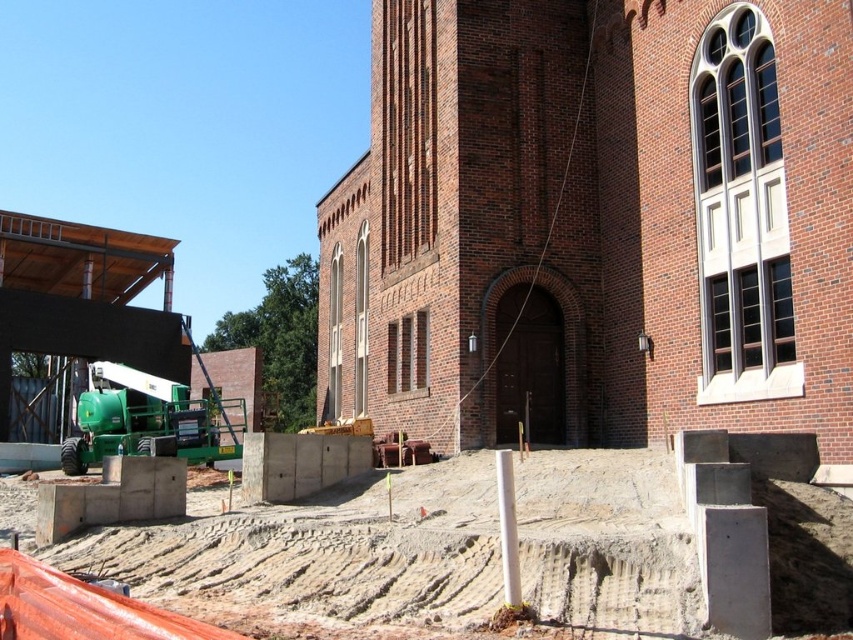
Is concrete at center further to the viewer compared to green metallic crane at left?

That is False.

Is point (321, 541) farther from viewer compared to point (99, 362)?

No, (321, 541) is in front of (99, 362).

What do you see at coordinates (659, 540) in the screenshot? I see `concrete at center` at bounding box center [659, 540].

Find the location of `concrete at center`. concrete at center is located at coordinates (659, 540).